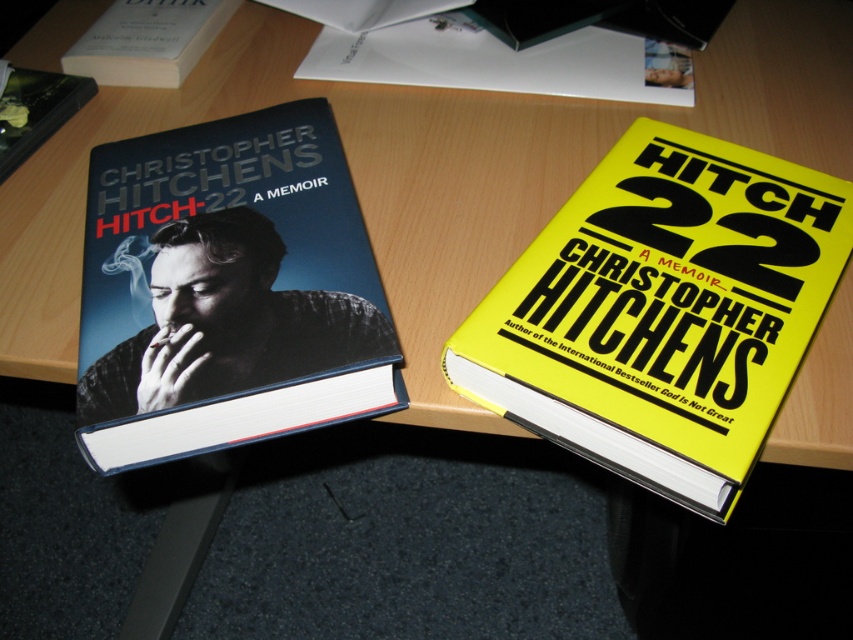
Based on the photo, can you confirm if yellow matte book at center is positioned below matte black book cover at left?

Yes.

Is yellow matte book at center to the left of matte black book cover at left from the viewer's perspective?

Incorrect, yellow matte book at center is not on the left side of matte black book cover at left.

Between point (722, 387) and point (212, 188), which one is positioned in front?

Point (722, 387) is in front.

At what (x,y) coordinates should I click in order to perform the action: click on yellow matte book at center. Please return your answer as a coordinate pair (x, y). The width and height of the screenshot is (853, 640). Looking at the image, I should click on (662, 310).

Does point (236, 336) come farther from viewer compared to point (230, 4)?

No, it is not.

In order to click on matte black book cover at left in this screenshot , I will do `click(227, 291)`.

Where is `matte black book cover at left`? matte black book cover at left is located at coordinates (227, 291).

Does yellow matte book at center appear over white paper at upper center?

Incorrect, yellow matte book at center is not positioned above white paper at upper center.

Looking at this image, is yellow matte book at center below white paper at upper center?

Correct, yellow matte book at center is located below white paper at upper center.

Find the location of a particular element. The image size is (853, 640). yellow matte book at center is located at coordinates (662, 310).